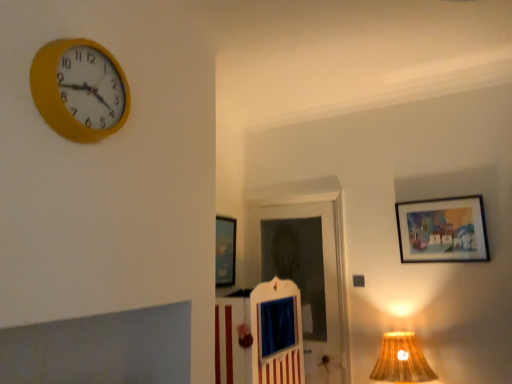
Question: Is matte wooden picture frame at upper right, arranged as the 2th picture frame when viewed from the back, shorter than metallic silver picture frame at center, which is counted as the first picture frame, starting from the left?

Choices:
 (A) no
 (B) yes

Answer: (B)

Question: Does matte wooden picture frame at upper right, arranged as the 2th picture frame when viewed from the back, appear on the left side of metallic silver picture frame at center, which ranks as the 1th picture frame in back-to-front order?

Choices:
 (A) no
 (B) yes

Answer: (A)

Question: Is matte wooden picture frame at upper right, the second picture frame when ordered from left to right, far from metallic silver picture frame at center, the 2th picture frame in the front-to-back sequence?

Choices:
 (A) no
 (B) yes

Answer: (B)

Question: Considering the relative positions of matte wooden picture frame at upper right, arranged as the 2th picture frame when viewed from the back, and metallic silver picture frame at center, the 2th picture frame in the front-to-back sequence, in the image provided, is matte wooden picture frame at upper right, arranged as the 2th picture frame when viewed from the back, behind metallic silver picture frame at center, the 2th picture frame in the front-to-back sequence,?

Choices:
 (A) no
 (B) yes

Answer: (A)

Question: Would you say matte wooden picture frame at upper right, arranged as the 2th picture frame when viewed from the back, is outside metallic silver picture frame at center, which is counted as the first picture frame, starting from the left?

Choices:
 (A) yes
 (B) no

Answer: (A)

Question: Is matte wooden picture frame at upper right, arranged as the 2th picture frame when viewed from the back, taller than metallic silver picture frame at center, the 2th picture frame in the front-to-back sequence?

Choices:
 (A) no
 (B) yes

Answer: (A)

Question: From the image's perspective, is braided fabric lampshade at lower right on matte wooden picture frame at upper right, the second picture frame when ordered from left to right?

Choices:
 (A) yes
 (B) no

Answer: (B)

Question: Can you see braided fabric lampshade at lower right touching matte wooden picture frame at upper right, which is counted as the 1th picture frame, starting from the front?

Choices:
 (A) yes
 (B) no

Answer: (B)

Question: Is braided fabric lampshade at lower right positioned beyond the bounds of matte wooden picture frame at upper right, which is counted as the 1th picture frame, starting from the front?

Choices:
 (A) no
 (B) yes

Answer: (B)

Question: Is braided fabric lampshade at lower right facing away from matte wooden picture frame at upper right, positioned as the 1th picture frame in right-to-left order?

Choices:
 (A) no
 (B) yes

Answer: (A)

Question: Can you confirm if braided fabric lampshade at lower right is thinner than matte wooden picture frame at upper right, the second picture frame when ordered from left to right?

Choices:
 (A) no
 (B) yes

Answer: (A)

Question: From a real-world perspective, is braided fabric lampshade at lower right positioned under matte wooden picture frame at upper right, arranged as the 2th picture frame when viewed from the back, based on gravity?

Choices:
 (A) no
 (B) yes

Answer: (B)

Question: Is yellow plastic wall clock at upper left facing towards metallic silver picture frame at center, arranged as the second picture frame when viewed from the right?

Choices:
 (A) no
 (B) yes

Answer: (A)